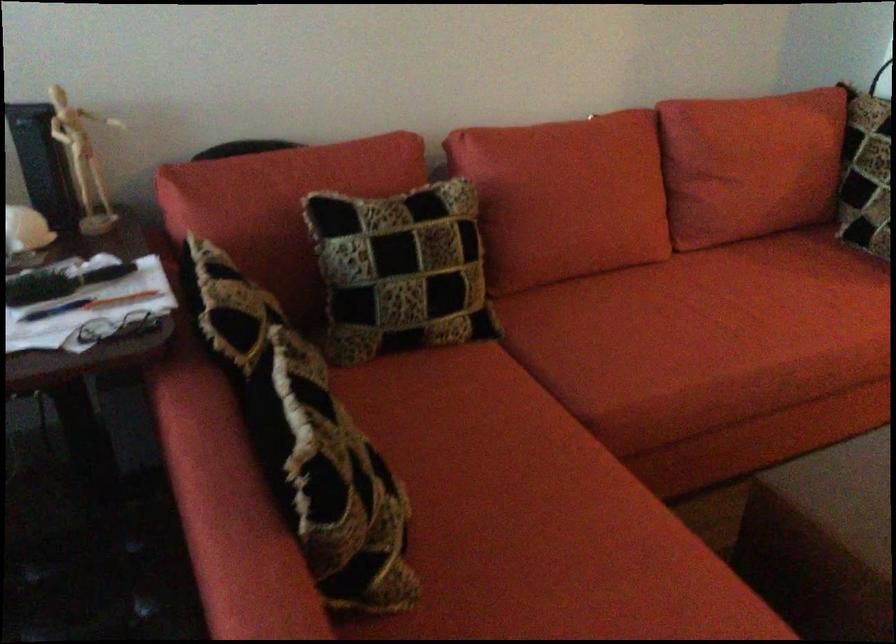
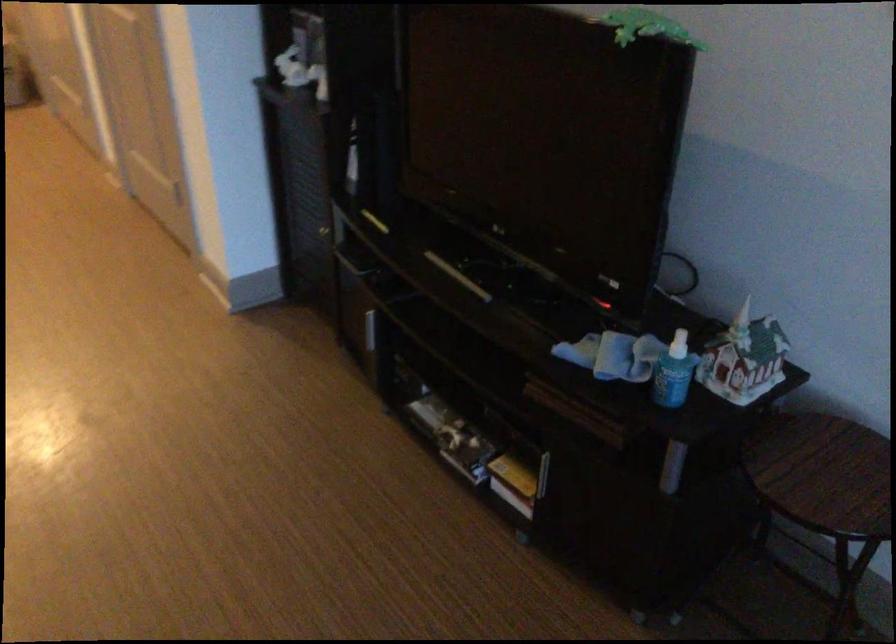
How did the camera likely rotate?

The camera rotated toward right-down.